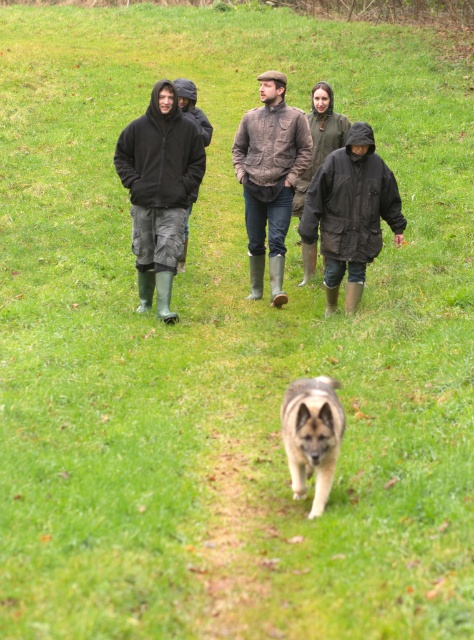
Question: Which of the following is the farthest from the observer?

Choices:
 (A) dark matte jacket at center
 (B) brown leather jacket at center
 (C) brown fur dog at center
 (D) dark brown leather jacket at center

Answer: (B)

Question: Does dark brown leather jacket at center lie behind dark matte jacket at center?

Choices:
 (A) yes
 (B) no

Answer: (A)

Question: From the image, what is the correct spatial relationship of dark brown leather jacket at center in relation to matte black jacket at left?

Choices:
 (A) below
 (B) above

Answer: (B)

Question: Which object appears closest to the camera in this image?

Choices:
 (A) dark brown leather jacket at center
 (B) matte black jacket at left
 (C) dark matte jacket at center
 (D) brown leather jacket at center

Answer: (C)

Question: Is matte black jacket at left smaller than brown leather jacket at center?

Choices:
 (A) yes
 (B) no

Answer: (A)

Question: Which of these objects is positioned farthest from the dark matte jacket at center?

Choices:
 (A) brown leather jacket at center
 (B) matte black jacket at left
 (C) dark brown leather jacket at center
 (D) brown fur dog at center

Answer: (D)